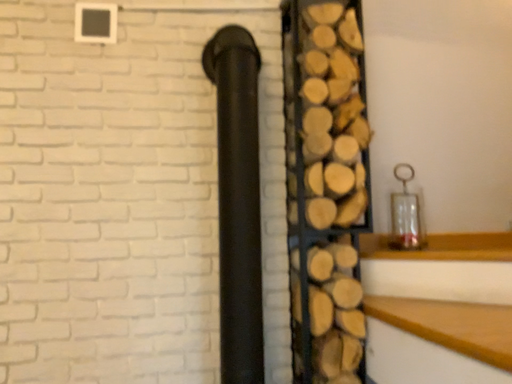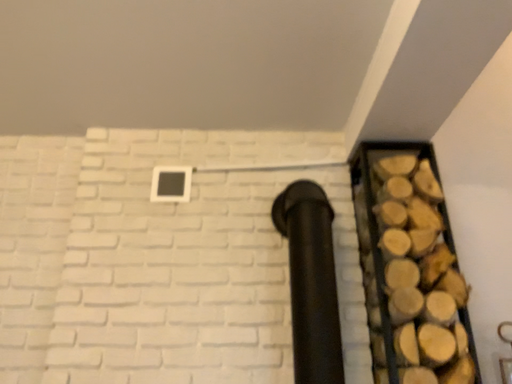
Question: How did the camera likely rotate when shooting the video?

Choices:
 (A) rotated left
 (B) rotated right

Answer: (A)